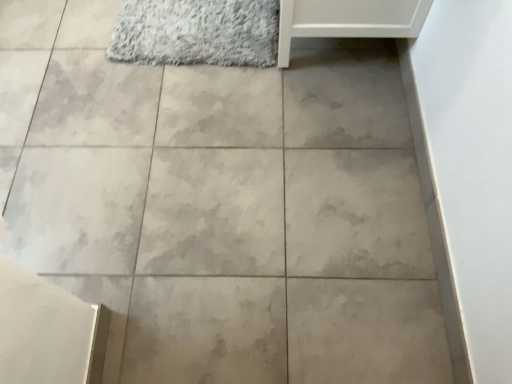
Locate an element on the screen. free space above white shaggy bath mat at upper left (from a real-world perspective) is located at coordinates (195, 24).